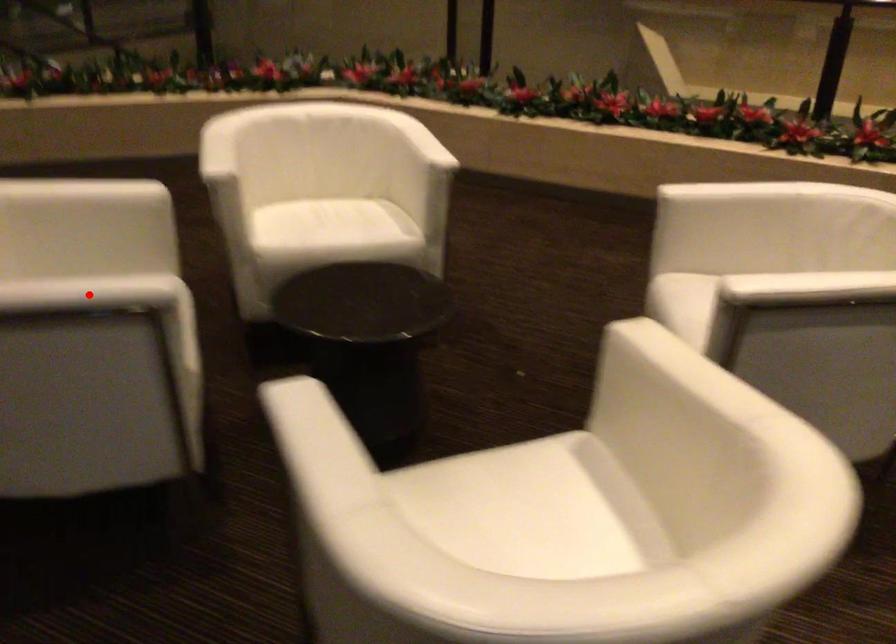
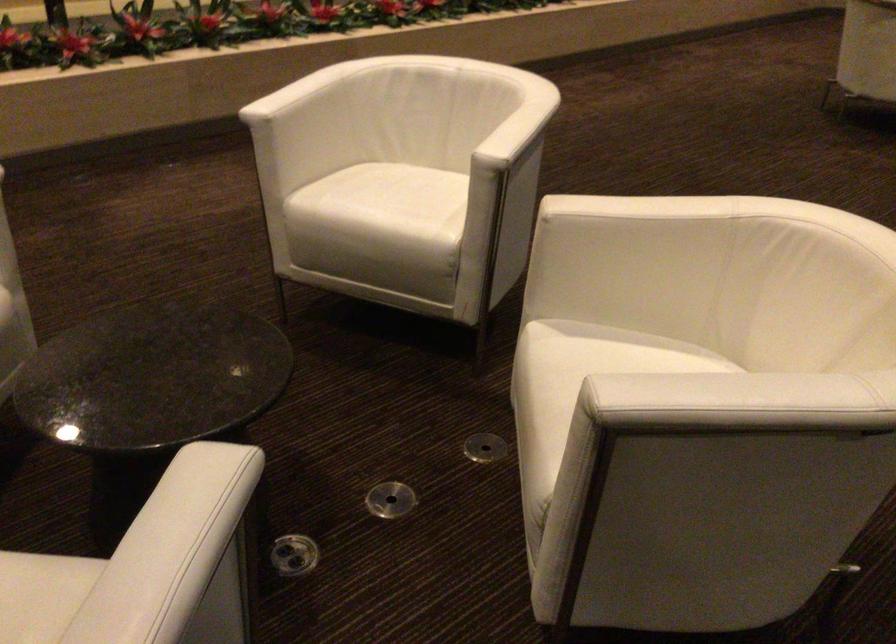
Question: I am providing you with two images of the same scene from different viewpoints. A red point is shown in image1. For the corresponding object point in image2, is it positioned nearer or farther from the camera?

Choices:
 (A) Nearer
 (B) Farther

Answer: (A)